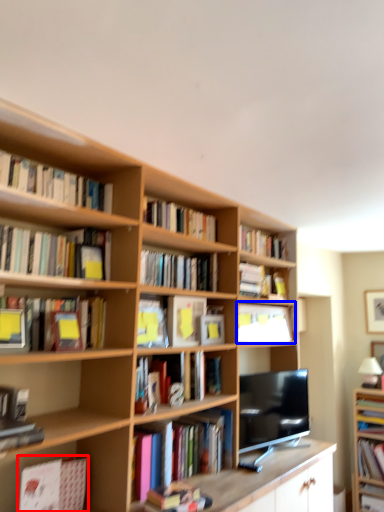
Question: Which object appears closest to the camera in this image, book (highlighted by a red box) or book (highlighted by a blue box)?

Choices:
 (A) book
 (B) book

Answer: (A)